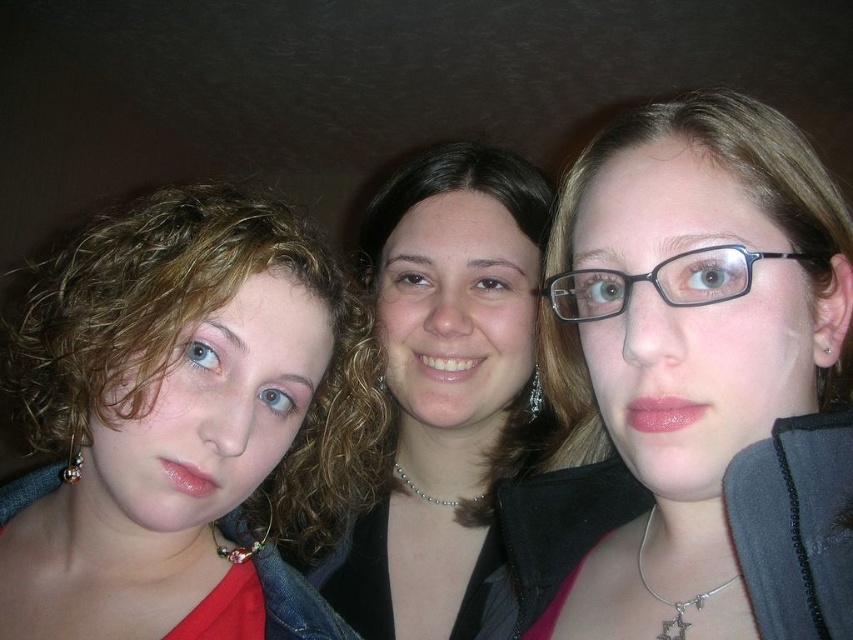
You are standing 20 inches away from the image. Can you reach the point at coordinates point (840, 250)?

The point at coordinates point (840, 250) is 17.40 inches away from the viewer. Since you are standing 20 inches away, you are farther away than the point, so you cannot reach it.

You are standing 50 centimeters away from the image. You want to touch the point at coordinates point (x=129, y=481). Can you reach it without moving closer?

The distance of point (x=129, y=481) from viewer is 44.18 centimeters. Since you are standing 50 centimeters away, you can reach it without moving closer.